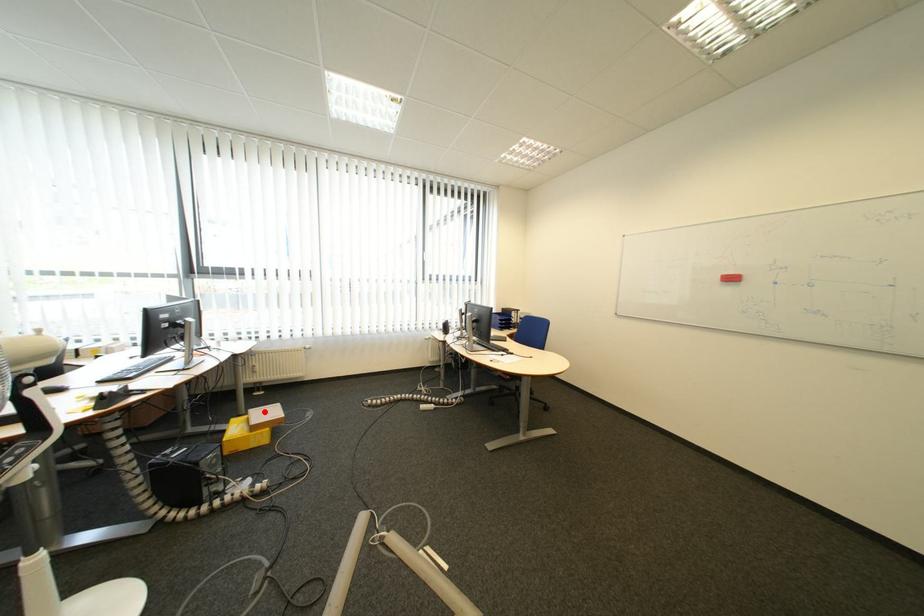
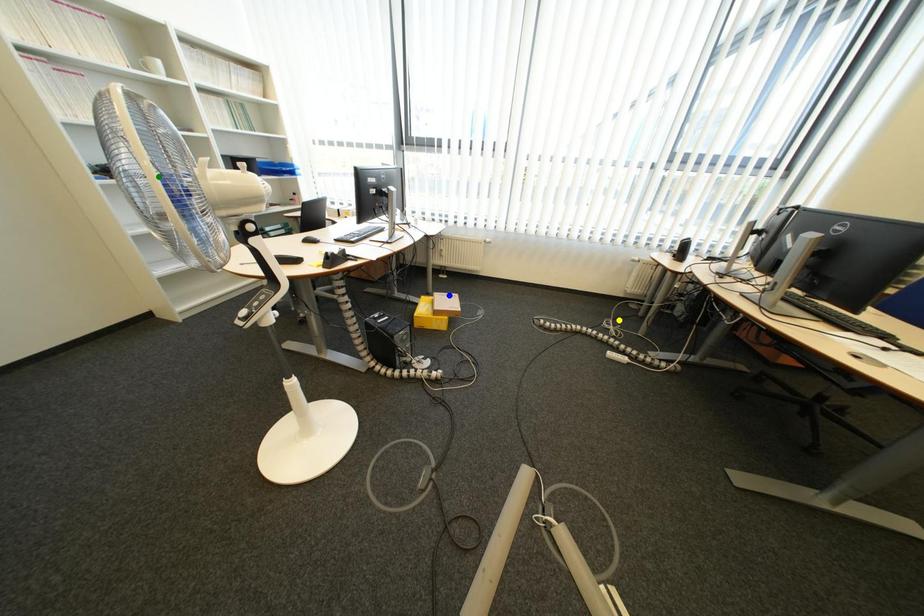
Question: I am providing you with two images of the same scene from different viewpoints. A red point is marked on the first image. You are given multiple points on the second image. In image 2, which mark is for the same physical point as the one in image 1?

Choices:
 (A) green point
 (B) blue point
 (C) yellow point

Answer: (B)